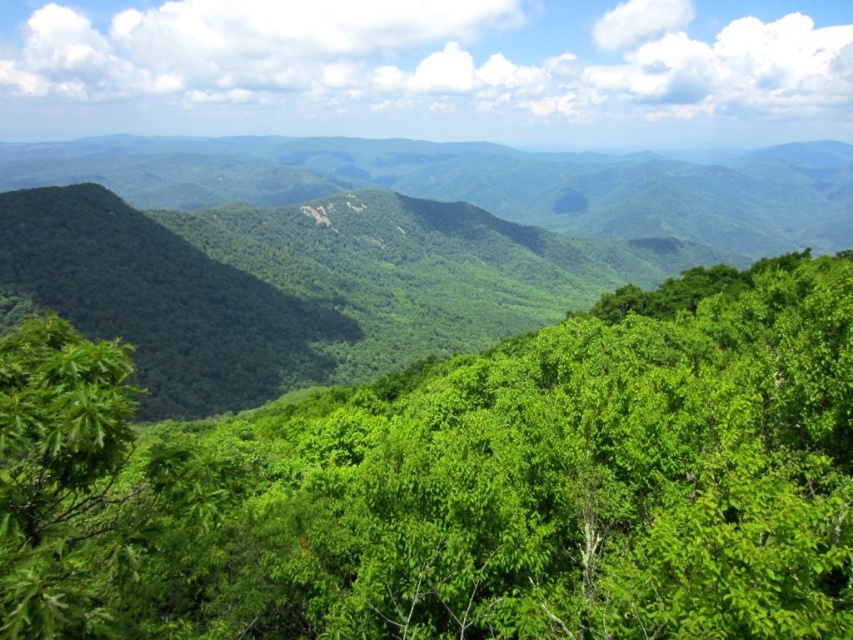
Does green leafy tree at center come behind green leafy forest at center?

That is False.

Does green leafy tree at center have a greater width compared to green leafy forest at center?

No.

Find the location of `green leafy tree at center`. green leafy tree at center is located at coordinates (457, 483).

Where is `green leafy tree at center`? This screenshot has height=640, width=853. green leafy tree at center is located at coordinates (457, 483).